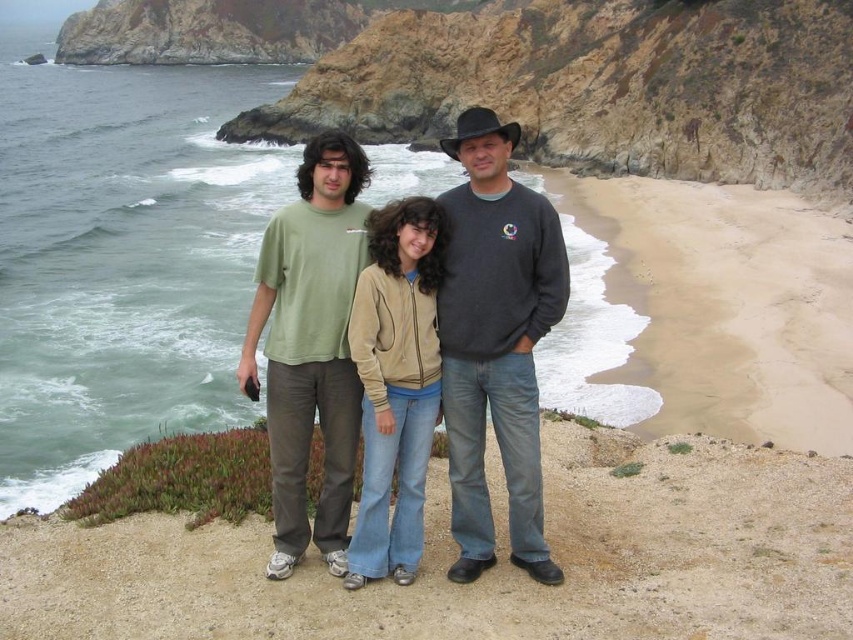
Question: Can you confirm if dark gray sweater at center is thinner than tan suede jacket at center?

Choices:
 (A) no
 (B) yes

Answer: (A)

Question: Observing the image, what is the correct spatial positioning of matte green t-shirt at center in reference to dark gray sweater at center?

Choices:
 (A) above
 (B) below

Answer: (B)

Question: Considering the relative positions of matte green t-shirt at center and green cotton t-shirt at center in the image provided, where is matte green t-shirt at center located with respect to green cotton t-shirt at center?

Choices:
 (A) above
 (B) below

Answer: (A)

Question: Which of the following is the closest to the observer?

Choices:
 (A) (457, 540)
 (B) (320, 355)
 (C) (523, 472)
 (D) (373, 244)

Answer: (C)

Question: Which object is the farthest from the tan suede jacket at center?

Choices:
 (A) green cotton t-shirt at center
 (B) dark gray sweater at center

Answer: (B)

Question: Which point appears closest to the camera in this image?

Choices:
 (A) (459, 244)
 (B) (380, 422)
 (C) (322, 353)

Answer: (B)